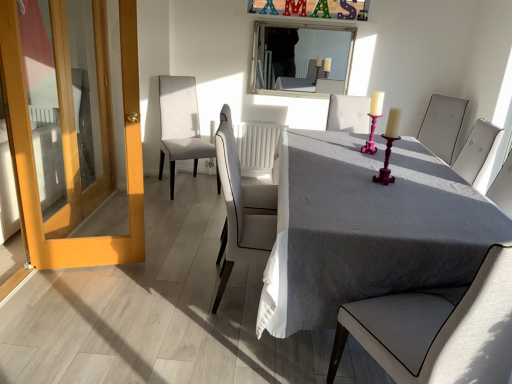
What is the approximate width of light gray fabric chair at center, which is the 1th chair in front-to-back order?

The width of light gray fabric chair at center, which is the 1th chair in front-to-back order, is 24.68 inches.

The height and width of the screenshot is (384, 512). What do you see at coordinates (438, 330) in the screenshot?
I see `light gray fabric chair at center, the 5th chair positioned from the back` at bounding box center [438, 330].

Identify the location of gray fabric table at center. The height and width of the screenshot is (384, 512). (367, 228).

I want to click on white leather chair at center, the fourth chair viewed from the right, so click(242, 211).

Measure the distance between point (317, 56) and camera.

Point (317, 56) and camera are 14.66 feet apart from each other.

Find the location of a particular element. This screenshot has width=512, height=384. wooden door at left is located at coordinates (34, 162).

Is light beige fabric chair at center, which ranks as the 5th chair in front-to-back order, wider than white framed mirror at upper center?

Yes.

Could you measure the distance between light beige fabric chair at center, which is counted as the 1th chair, starting from the left, and white framed mirror at upper center?

The distance of light beige fabric chair at center, which is counted as the 1th chair, starting from the left, from white framed mirror at upper center is 3.39 feet.

From a real-world perspective, is light beige fabric chair at center, which is counted as the 1th chair, starting from the left, beneath white framed mirror at upper center?

Yes, from a real-world perspective, light beige fabric chair at center, which is counted as the 1th chair, starting from the left, is below white framed mirror at upper center.

Which object is more forward, light beige fabric chair at center, which ranks as the 5th chair in front-to-back order, or white framed mirror at upper center?

light beige fabric chair at center, which ranks as the 5th chair in front-to-back order, is in front.

From a real-world perspective, starting from the light gray fabric chair at center, which is counted as the 3th chair, starting from the left, which chair is the 3rd one vertically above it? Please provide its 2D coordinates.

[(442, 125)]

Consider the image. Are white fabric chair at upper right, the second chair from the back, and light gray fabric chair at center, which is the 1th chair in front-to-back order, making contact?

No.

Based on the photo, from a real-world perspective, is white fabric chair at upper right, positioned as the fourth chair in front-to-back order, positioned above or below light gray fabric chair at center, the 5th chair positioned from the back?

white fabric chair at upper right, positioned as the fourth chair in front-to-back order, is above light gray fabric chair at center, the 5th chair positioned from the back.

Does white fabric chair at upper right, positioned as the fourth chair in front-to-back order, turn towards light gray fabric chair at center, which is counted as the 3th chair, starting from the left?

No, white fabric chair at upper right, positioned as the fourth chair in front-to-back order, is not facing towards light gray fabric chair at center, which is counted as the 3th chair, starting from the left.

Is white leather chair at center, which appears as the second chair when viewed from the left, next to white framed mirror at upper center and touching it?

No, white leather chair at center, which appears as the second chair when viewed from the left, is not in contact with white framed mirror at upper center.

Is white leather chair at center, which is counted as the fourth chair, starting from the back, inside or outside of white framed mirror at upper center?

white leather chair at center, which is counted as the fourth chair, starting from the back, is not enclosed by white framed mirror at upper center.

Consider the image. Looking at the image, does white leather chair at center, which appears as the second chair when viewed from the left, seem bigger or smaller compared to white framed mirror at upper center?

white leather chair at center, which appears as the second chair when viewed from the left, is bigger than white framed mirror at upper center.

Would you say white leather chair at center, the fourth chair viewed from the right, is to the left or to the right of white framed mirror at upper center in the picture?

In the image, white leather chair at center, the fourth chair viewed from the right, appears on the left side of white framed mirror at upper center.

Which point is more distant from viewer, [362,129] or [333,90]?

The point [333,90] is farther from the camera.

Who is shorter, matte white chair at center, which is the 4th chair from left to right, or white framed mirror at upper center?

matte white chair at center, which is the 4th chair from left to right, is shorter.

Which object is wider, matte white chair at center, the third chair in the front-to-back sequence, or white framed mirror at upper center?

Wider between the two is matte white chair at center, the third chair in the front-to-back sequence.

Does wooden door at left appear on the left side of gray fabric table at center?

Yes.

Looking at this image, can you confirm if wooden door at left is shorter than gray fabric table at center?

Incorrect, the height of wooden door at left does not fall short of that of gray fabric table at center.

Considering the relative sizes of wooden door at left and gray fabric table at center in the image provided, is wooden door at left bigger than gray fabric table at center?

Incorrect, wooden door at left is not larger than gray fabric table at center.

Locate an element on the screen. Image resolution: width=512 pixels, height=384 pixels. table that appears below the wooden door at left (from the image's perspective) is located at coordinates (367, 228).

Is white fabric chair at upper right, the second chair from the back, taller or shorter than white framed mirror at upper center?

Clearly, white fabric chair at upper right, the second chair from the back, is shorter compared to white framed mirror at upper center.

From the image's perspective, is white fabric chair at upper right, the second chair from the back, on top of white framed mirror at upper center?

Actually, white fabric chair at upper right, the second chair from the back, appears below white framed mirror at upper center in the image.

The height and width of the screenshot is (384, 512). I want to click on mirror located above the white fabric chair at upper right, which is counted as the fifth chair, starting from the left (from the image's perspective), so click(x=303, y=60).

Is white leather chair at center, which appears as the second chair when viewed from the left, not inside wooden door at left?

Yes, white leather chair at center, which appears as the second chair when viewed from the left, is located beyond the bounds of wooden door at left.

Does point (233, 158) come in front of point (31, 204)?

Yes, point (233, 158) is closer to viewer.

Is white leather chair at center, the fourth chair viewed from the right, far away from wooden door at left?

No, white leather chair at center, the fourth chair viewed from the right, is not far from wooden door at left.

Is white leather chair at center, the fourth chair viewed from the right, in front of wooden door at left?

Yes, the depth of white leather chair at center, the fourth chair viewed from the right, is less than that of wooden door at left.

Locate an element on the screen. The width and height of the screenshot is (512, 384). the 4th chair below the white framed mirror at upper center (from a real-world perspective) is located at coordinates (180, 125).

Where is `the 2nd chair to the left of the white fabric chair at upper right, which is counted as the fifth chair, starting from the left, starting your count from the anchor`? The width and height of the screenshot is (512, 384). the 2nd chair to the left of the white fabric chair at upper right, which is counted as the fifth chair, starting from the left, starting your count from the anchor is located at coordinates (438, 330).

Considering their positions, is matte white chair at center, the second chair positioned from the right, positioned closer to white fabric chair at upper right, which is counted as the fifth chair, starting from the left, than light beige fabric chair at center, acting as the first chair starting from the back?

matte white chair at center, the second chair positioned from the right, is positioned closer to the anchor white fabric chair at upper right, which is counted as the fifth chair, starting from the left.

Looking at the image, which one is located further to white framed mirror at upper center, light beige fabric chair at center, marked as the fifth chair in a right-to-left arrangement, or gray fabric table at center?

gray fabric table at center is positioned further to the anchor white framed mirror at upper center.

When comparing their distances from matte white chair at center, the third chair in the front-to-back sequence, does white fabric chair at upper right, the 1th chair viewed from the right, or light gray fabric chair at center, marked as the third chair in a right-to-left arrangement, seem closer?

Among the two, white fabric chair at upper right, the 1th chair viewed from the right, is located nearer to matte white chair at center, the third chair in the front-to-back sequence.

Considering their positions, is gray fabric table at center positioned further to white fabric chair at upper right, which is counted as the fifth chair, starting from the left, than matte white chair at center, the third chair in the front-to-back sequence?

gray fabric table at center is further to white fabric chair at upper right, which is counted as the fifth chair, starting from the left.

Based on their spatial positions, is white framed mirror at upper center or matte white chair at center, the 3th chair viewed from the back, further from light gray fabric chair at center, marked as the third chair in a right-to-left arrangement?

white framed mirror at upper center is positioned further to the anchor light gray fabric chair at center, marked as the third chair in a right-to-left arrangement.

Based on their spatial positions, is wooden door at left or white leather chair at center, which is counted as the fourth chair, starting from the back, closer to white framed mirror at upper center?

white leather chair at center, which is counted as the fourth chair, starting from the back, is closer to white framed mirror at upper center.

Based on their spatial positions, is wooden door at left or matte white chair at center, the third chair in the front-to-back sequence, further from light beige fabric chair at center, marked as the fifth chair in a right-to-left arrangement?

wooden door at left is further to light beige fabric chair at center, marked as the fifth chair in a right-to-left arrangement.

Based on their spatial positions, is light beige fabric chair at center, which ranks as the 5th chair in front-to-back order, or matte white chair at center, the second chair positioned from the right, closer to white framed mirror at upper center?

matte white chair at center, the second chair positioned from the right, is closer to white framed mirror at upper center.

The height and width of the screenshot is (384, 512). Identify the location of chair positioned between white leather chair at center, the second chair in the front-to-back sequence, and white fabric chair at upper right, which is counted as the fifth chair, starting from the left, from near to far. (349, 114).

What are the coordinates of `table located between wooden door at left and light gray fabric chair at center, the 5th chair positioned from the back, in the left-right direction` in the screenshot? It's located at (367, 228).

The height and width of the screenshot is (384, 512). Find the location of `table positioned between light gray fabric chair at center, which is the 1th chair in front-to-back order, and white fabric chair at upper right, the second chair from the back, from near to far`. table positioned between light gray fabric chair at center, which is the 1th chair in front-to-back order, and white fabric chair at upper right, the second chair from the back, from near to far is located at coordinates (367, 228).

Find the location of a particular element. This screenshot has width=512, height=384. table between light gray fabric chair at center, which is the 1th chair in front-to-back order, and white leather chair at center, the fourth chair viewed from the right, along the z-axis is located at coordinates (367, 228).